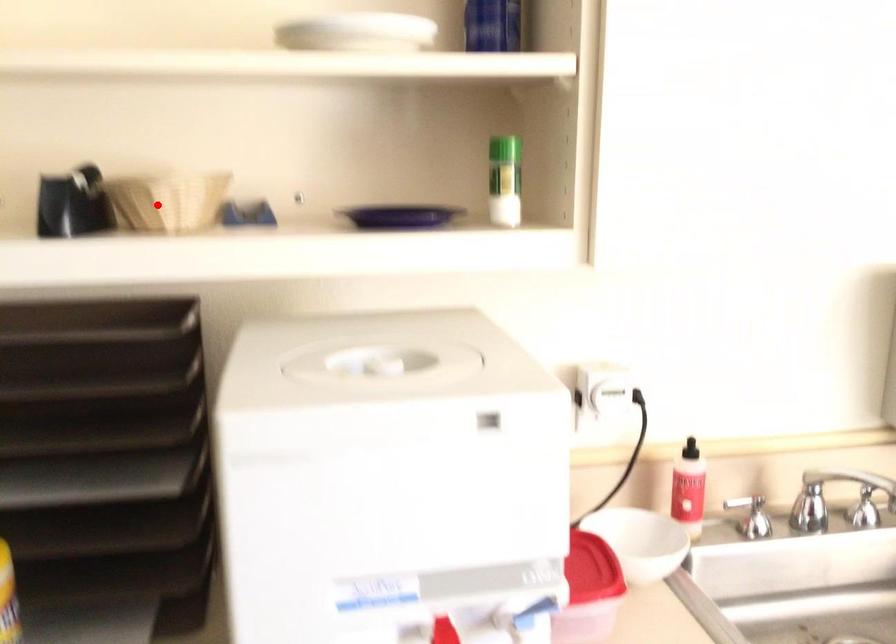
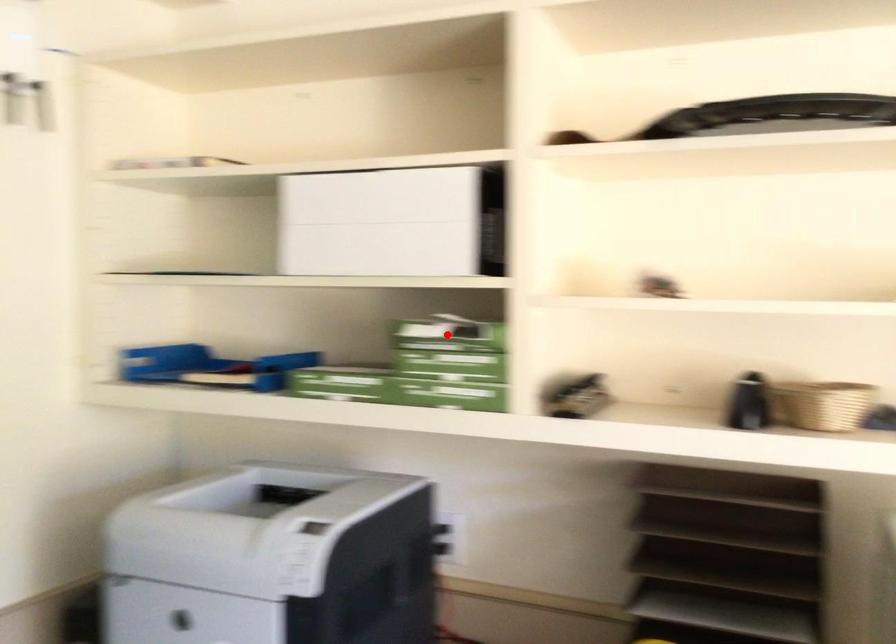
I am providing you with two images of the same scene from different viewpoints. A red point is marked on the first image and another point is marked on the second image. Are the points marked in image1 and image2 representing the same 3D position?

No